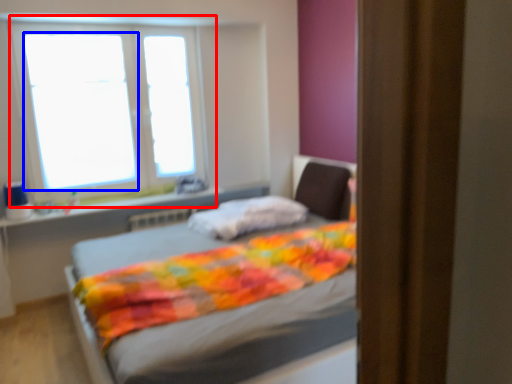
Question: Which object is closer to the camera taking this photo, window (highlighted by a red box) or window screen (highlighted by a blue box)?

Choices:
 (A) window
 (B) window screen

Answer: (A)